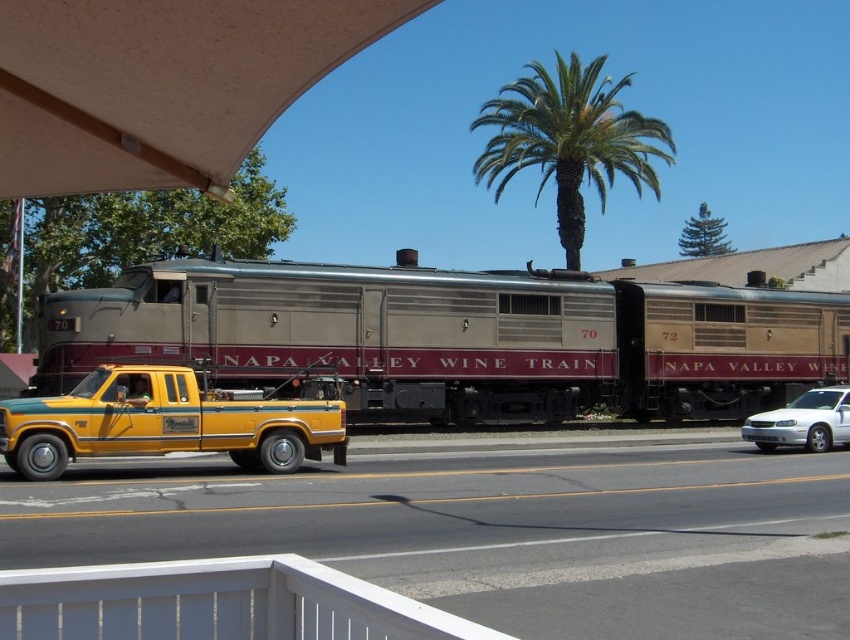
Does white wooden rail at lower center have a smaller size compared to yellow matte truck at lower left?

Indeed, white wooden rail at lower center has a smaller size compared to yellow matte truck at lower left.

Is the position of white wooden rail at lower center less distant than that of yellow matte truck at lower left?

Yes, it is.

At what (x,y) coordinates should I click in order to perform the action: click on white wooden rail at lower center. Please return your answer as a coordinate pair (x, y). This screenshot has width=850, height=640. Looking at the image, I should click on (216, 604).

Does point (354, 579) come behind point (796, 413)?

No.

Who is taller, white wooden rail at lower center or white glossy sedan at center?

With more height is white glossy sedan at center.

Is point (139, 605) farther from viewer compared to point (790, 406)?

No, (139, 605) is closer to viewer.

You are a GUI agent. You are given a task and a screenshot of the screen. Output one action in this format:
    pyautogui.click(x=<x>, y=<y>)
    Task: Click on the white wooden rail at lower center
    The image size is (850, 640).
    Given the screenshot: What is the action you would take?
    pyautogui.click(x=216, y=604)

Consider the image. Does yellow matte truck at lower left lie behind white glossy sedan at center?

No, yellow matte truck at lower left is closer to the viewer.

From the picture: Which is more to the right, yellow matte truck at lower left or white glossy sedan at center?

Positioned to the right is white glossy sedan at center.

Is point (75, 440) in front of point (783, 440)?

Yes, it is.

Locate an element on the screen. This screenshot has height=640, width=850. yellow matte truck at lower left is located at coordinates (163, 422).